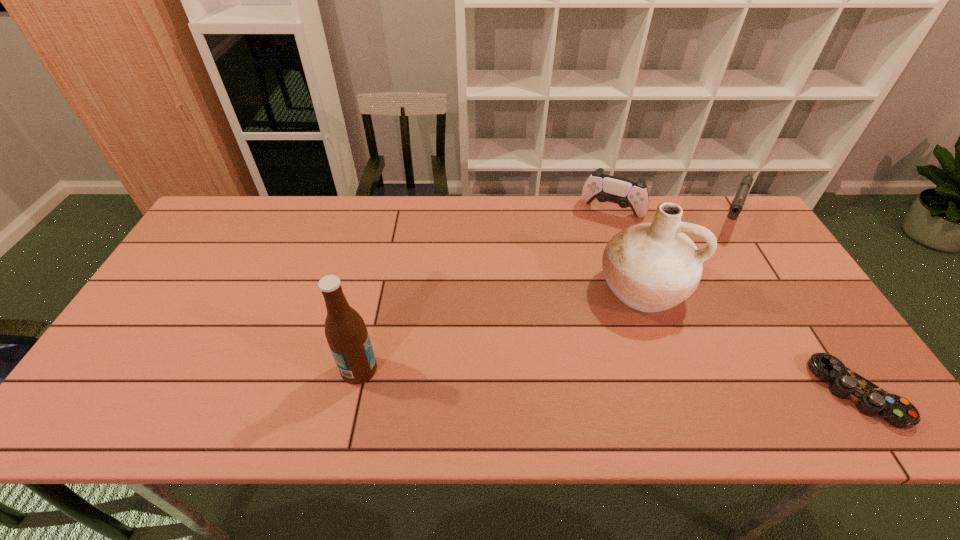
The image size is (960, 540). In order to click on the leftmost object in this screenshot , I will do `click(346, 333)`.

The image size is (960, 540). What are the coordinates of `the shorter control` in the screenshot? It's located at (870, 399).

The width and height of the screenshot is (960, 540). What are the coordinates of `the nearer control` in the screenshot? It's located at (870, 399).

You are a GUI agent. You are given a task and a screenshot of the screen. Output one action in this format:
    pyautogui.click(x=<x>, y=<y>)
    Task: Click on the third nearest object
    Image resolution: width=960 pixels, height=540 pixels.
    Given the screenshot: What is the action you would take?
    pyautogui.click(x=650, y=267)

Where is `gun`? The image size is (960, 540). gun is located at coordinates (737, 204).

Locate an element on the screen. The height and width of the screenshot is (540, 960). the left control is located at coordinates (626, 193).

Where is `the farther control`? the farther control is located at coordinates (626, 193).

You are a GUI agent. You are given a task and a screenshot of the screen. Output one action in this format:
    pyautogui.click(x=<x>, y=<y>)
    Task: Click on the blank space located on the right of the leftmost object
    
    Given the screenshot: What is the action you would take?
    pyautogui.click(x=500, y=369)

I want to click on vacant space located 0.200m on the left of the shortest object, so click(x=732, y=392).

At what (x,y) coordinates should I click in order to perform the action: click on free point located to pour from the handle of the pottery. Please return your answer as a coordinate pair (x, y). Looking at the image, I should click on (610, 390).